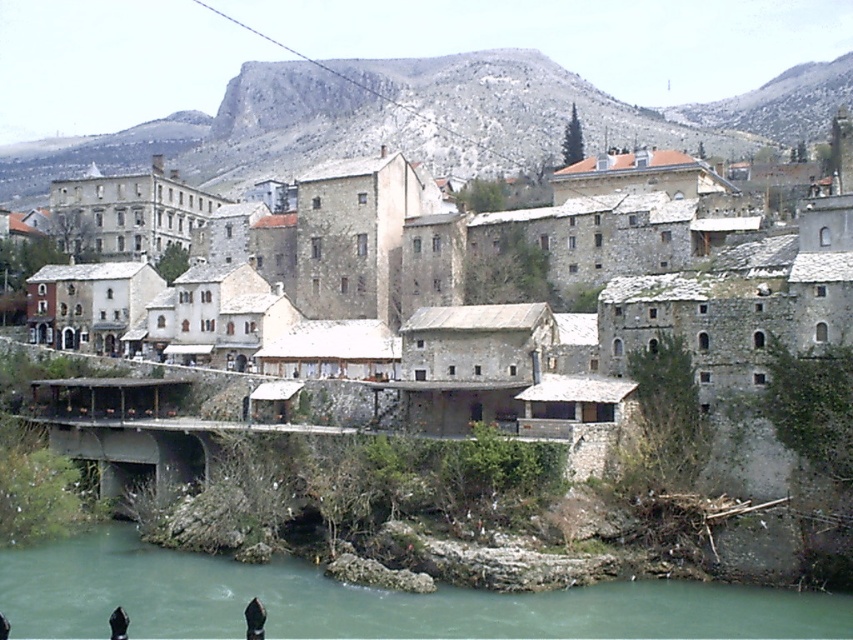
Question: Can you confirm if snowy rocky hillside at upper center is bigger than green stone river at lower center?

Choices:
 (A) yes
 (B) no

Answer: (A)

Question: Which of these objects is positioned closest to the snowy rocky hillside at upper center?

Choices:
 (A) stone bridge at center
 (B) green stone river at lower center

Answer: (A)

Question: Among these points, which one is farthest from the camera?

Choices:
 (A) (392, 106)
 (B) (248, 310)

Answer: (A)

Question: Which of the following is the closest to the observer?

Choices:
 (A) (538, 348)
 (B) (744, 589)

Answer: (B)

Question: Is snowy rocky hillside at upper center above green stone river at lower center?

Choices:
 (A) no
 (B) yes

Answer: (B)

Question: Does stone bridge at center appear over snowy rocky hillside at upper center?

Choices:
 (A) yes
 (B) no

Answer: (B)